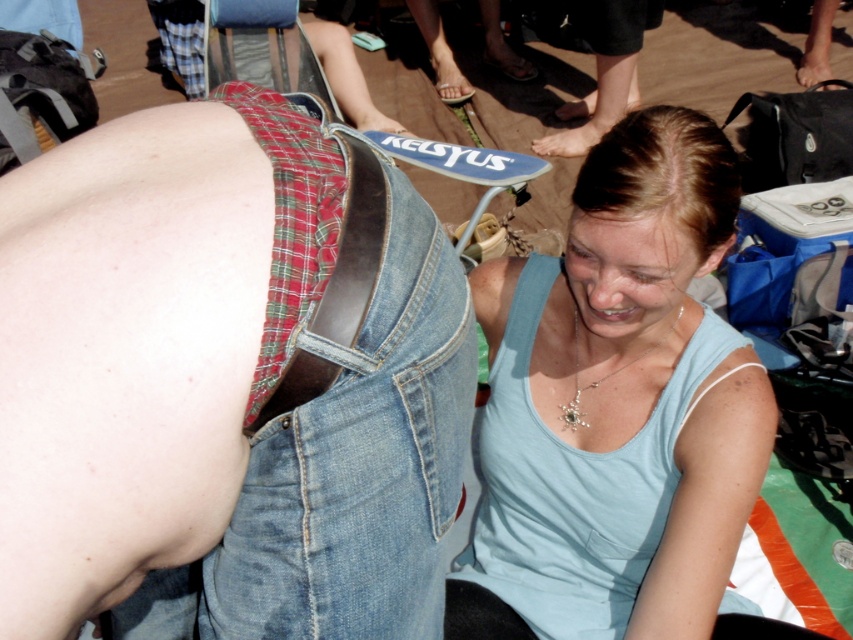
Which of these two, light blue tank top at center or denim at center, stands taller?

light blue tank top at center

Is light blue tank top at center shorter than denim at center?

In fact, light blue tank top at center may be taller than denim at center.

Which is behind, point (647, 234) or point (329, 452)?

Positioned behind is point (647, 234).

You are a GUI agent. You are given a task and a screenshot of the screen. Output one action in this format:
    pyautogui.click(x=<x>, y=<y>)
    Task: Click on the light blue tank top at center
    
    Given the screenshot: What is the action you would take?
    pyautogui.click(x=616, y=404)

Who is positioned more to the left, denim at center or leather belt at center?

denim at center is more to the left.

Is point (373, 248) closer to camera compared to point (387, 216)?

Yes, it is in front of point (387, 216).

The width and height of the screenshot is (853, 640). I want to click on denim at center, so [345, 470].

Who is positioned more to the right, light blue tank top at center or leather belt at center?

light blue tank top at center is more to the right.

Is light blue tank top at center positioned before leather belt at center?

No, light blue tank top at center is behind leather belt at center.

Between point (518, 264) and point (318, 388), which one is positioned in front?

Point (318, 388) is in front.

Where is `light blue tank top at center`? Image resolution: width=853 pixels, height=640 pixels. light blue tank top at center is located at coordinates (616, 404).